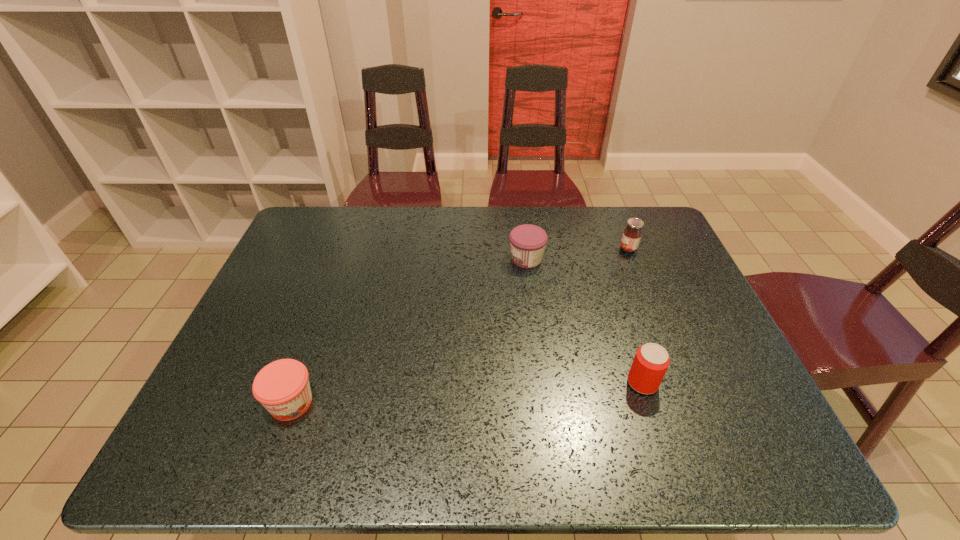
I want to click on vacant space at the far right corner of the desktop, so click(x=619, y=214).

Find the location of a particular element. The width and height of the screenshot is (960, 540). free area in between the second jam from right to left and the beer can is located at coordinates (585, 321).

Where is `free spot between the second jam from right to left and the leftmost jam`? This screenshot has width=960, height=540. free spot between the second jam from right to left and the leftmost jam is located at coordinates (409, 331).

This screenshot has width=960, height=540. I want to click on vacant space that is in between the leftmost object and the beer can, so 467,393.

Find the location of `blank region between the rightmost jam and the leftmost jam`. blank region between the rightmost jam and the leftmost jam is located at coordinates (460, 326).

At what (x,y) coordinates should I click in order to perform the action: click on vacant region between the rightmost object and the beer can. Please return your answer as a coordinate pair (x, y). The image size is (960, 540). Looking at the image, I should click on (636, 316).

Where is `vacant area that lies between the rightmost jam and the nearest jam`? This screenshot has width=960, height=540. vacant area that lies between the rightmost jam and the nearest jam is located at coordinates click(460, 326).

Locate an element on the screen. blank region between the second object from left to right and the nearest jam is located at coordinates (409, 331).

Locate an element on the screen. The height and width of the screenshot is (540, 960). empty space between the second object from left to right and the second object from right to left is located at coordinates (585, 321).

Find the location of `vacant space that is in between the rightmost jam and the nearest jam`. vacant space that is in between the rightmost jam and the nearest jam is located at coordinates (460, 326).